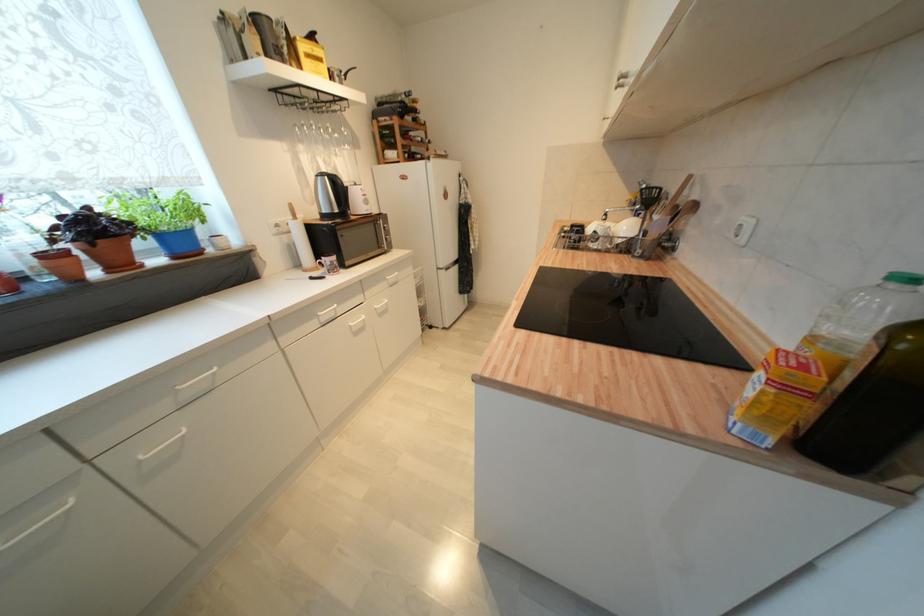
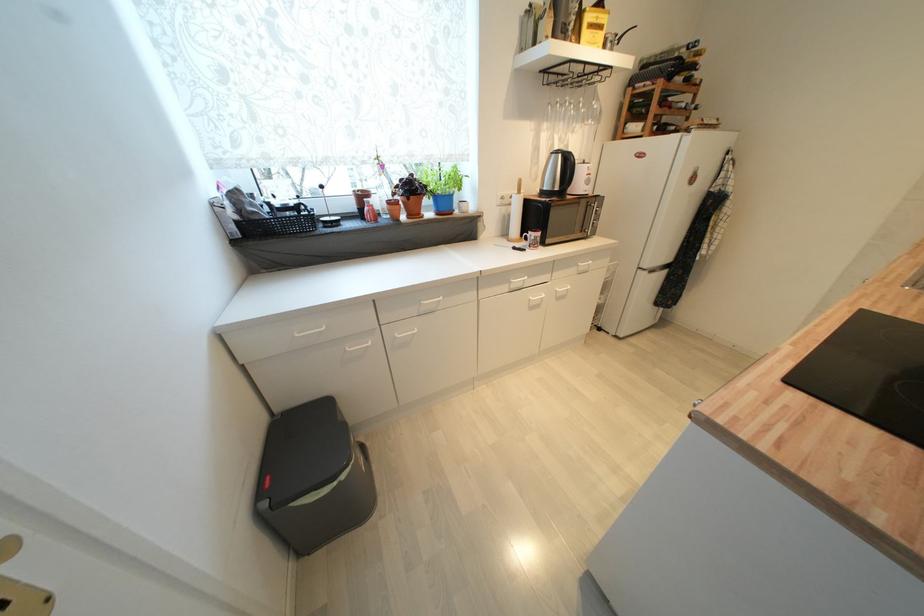
Where in the second image is the point corresponding to point (199, 214) from the first image?

(463, 184)